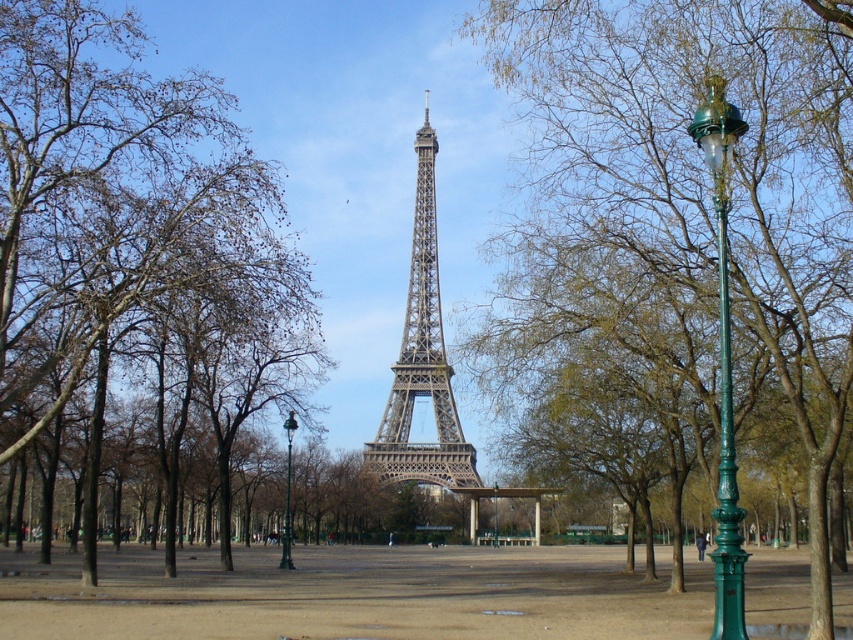
Question: Which is nearer to the metallic gray tower at center?

Choices:
 (A) brown leafy tree at left
 (B) green polished metal streetlight at right
 (C) green leafy tree at center

Answer: (C)

Question: Can you confirm if green leafy tree at center is positioned above green metal streetlight at center?

Choices:
 (A) no
 (B) yes

Answer: (B)

Question: Where is metallic gray tower at center located in relation to green metal streetlight at center in the image?

Choices:
 (A) above
 (B) below

Answer: (A)

Question: Among these objects, which one is farthest from the camera?

Choices:
 (A) brown leafy tree at left
 (B) metallic gray tower at center

Answer: (A)

Question: Does metallic gray tower at center appear on the right side of green polished metal streetlight at right?

Choices:
 (A) yes
 (B) no

Answer: (B)

Question: Which point is closer to the camera?

Choices:
 (A) green metal streetlight at center
 (B) green leafy tree at center

Answer: (B)